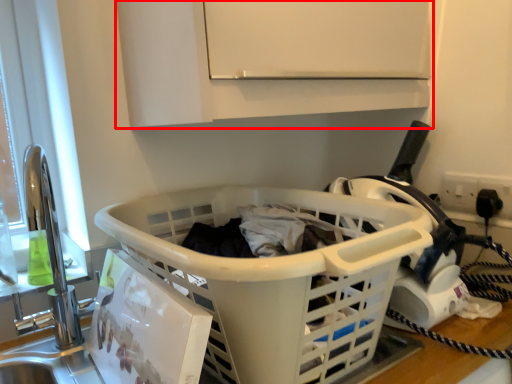
Question: From the image's perspective, where is cabinetry (annotated by the red box) located relative to basket?

Choices:
 (A) above
 (B) below

Answer: (A)